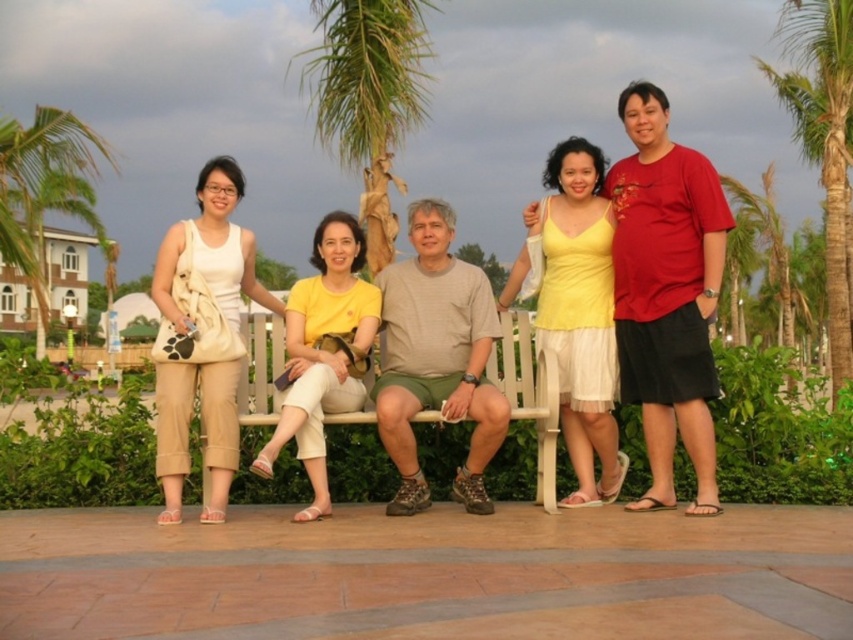
Question: Which point appears farthest from the camera in this image?

Choices:
 (A) (511, 376)
 (B) (225, 193)
 (C) (384, 97)
 (D) (372, 292)

Answer: (C)

Question: Among these objects, which one is nearest to the camera?

Choices:
 (A) yellow matte/yellow fabric at center
 (B) green leafy palm tree at upper center
 (C) green leafy palm tree at upper right
 (D) yellow matte tank top at center

Answer: (A)

Question: Does beige fabric purse at upper left have a greater width compared to beige fabric bag at left?

Choices:
 (A) yes
 (B) no

Answer: (B)

Question: Where is beige fabric bag at left located in relation to green leafy palm tree at upper right in the image?

Choices:
 (A) left
 (B) right

Answer: (A)

Question: Which point appears farthest from the camera in this image?

Choices:
 (A) (755, 60)
 (B) (187, 452)

Answer: (A)

Question: Does green leafy palm tree at upper center lie behind green leafy palm tree at left?

Choices:
 (A) no
 (B) yes

Answer: (A)